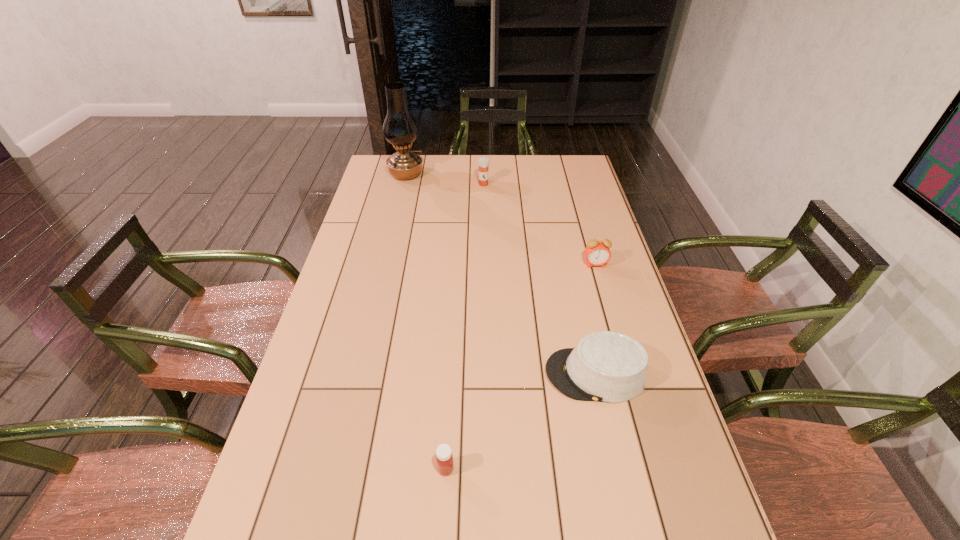
Where is `free point between the taller medicine and the nearer medicine`? free point between the taller medicine and the nearer medicine is located at coordinates (465, 327).

Find the location of a particular element. free space between the second object from left to right and the hat is located at coordinates (520, 421).

Locate an element on the screen. This screenshot has height=540, width=960. free space that is in between the second object from left to right and the alarm clock is located at coordinates (520, 367).

The width and height of the screenshot is (960, 540). In order to click on free point between the hat and the tallest object in this screenshot , I will do `click(501, 274)`.

The width and height of the screenshot is (960, 540). I want to click on free point between the tallest object and the third farthest object, so click(x=501, y=219).

Identify which object is the fourth nearest to the nearer medicine. Please provide its 2D coordinates. Your answer should be formatted as a tuple, i.e. [(x, y)], where the tuple contains the x and y coordinates of a point satisfying the conditions above.

[(400, 129)]

You are a GUI agent. You are given a task and a screenshot of the screen. Output one action in this format:
    pyautogui.click(x=<x>, y=<y>)
    Task: Click on the object that stands as the closest to the alarm clock
    This screenshot has width=960, height=540.
    Given the screenshot: What is the action you would take?
    pyautogui.click(x=605, y=366)

Find the location of `free region that satisfies the following two spatial constraints: 1. on the front-facing side of the second nearest object; 2. on the front side of the nearest object`. free region that satisfies the following two spatial constraints: 1. on the front-facing side of the second nearest object; 2. on the front side of the nearest object is located at coordinates (617, 469).

Identify the location of free space that satisfies the following two spatial constraints: 1. on the face of the third farthest object; 2. on the front-facing side of the hat. The image size is (960, 540). (627, 374).